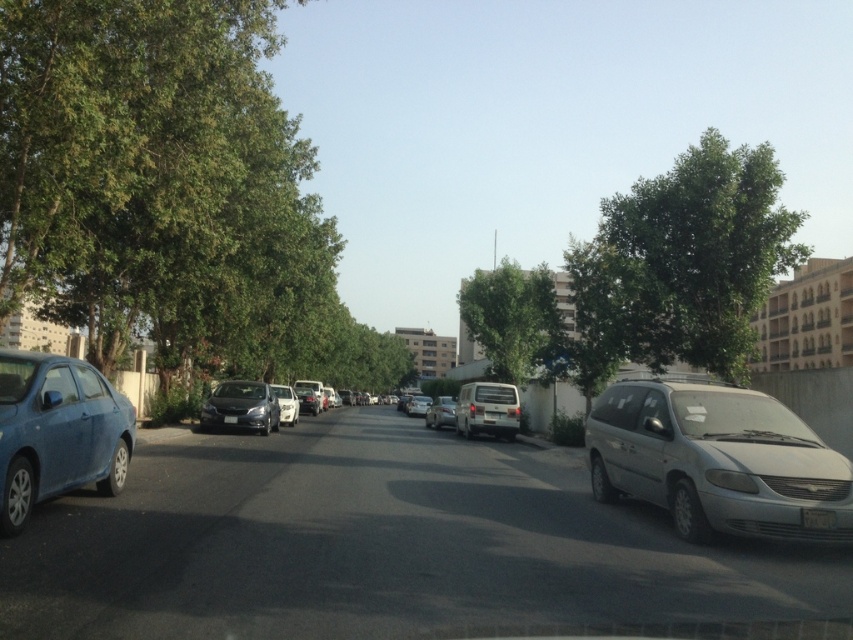
Is satin white sedan at center taller than white plastic license plate at lower right?

Correct, satin white sedan at center is much taller as white plastic license plate at lower right.

Between point (288, 412) and point (825, 522), which one is positioned behind?

Point (288, 412)

Where is `satin white sedan at center`? This screenshot has width=853, height=640. satin white sedan at center is located at coordinates (286, 403).

Is silver metallic minivan at right to the left of satin white sedan at center from the viewer's perspective?

Incorrect, silver metallic minivan at right is not on the left side of satin white sedan at center.

Is silver metallic minivan at right below satin white sedan at center?

No, silver metallic minivan at right is not below satin white sedan at center.

Between point (607, 397) and point (286, 410), which one is positioned in front?

Point (607, 397) is more forward.

At what (x,y) coordinates should I click in order to perform the action: click on silver metallic minivan at right. Please return your answer as a coordinate pair (x, y). Image resolution: width=853 pixels, height=640 pixels. Looking at the image, I should click on (715, 460).

The height and width of the screenshot is (640, 853). Describe the element at coordinates (440, 412) in the screenshot. I see `silver metallic van at center` at that location.

Does point (445, 401) come farther from viewer compared to point (231, 422)?

That is True.

Who is more forward, (450, 424) or (231, 420)?

Point (231, 420)

At what (x,y) coordinates should I click in order to perform the action: click on silver metallic van at center. Please return your answer as a coordinate pair (x, y). The width and height of the screenshot is (853, 640). Looking at the image, I should click on (440, 412).